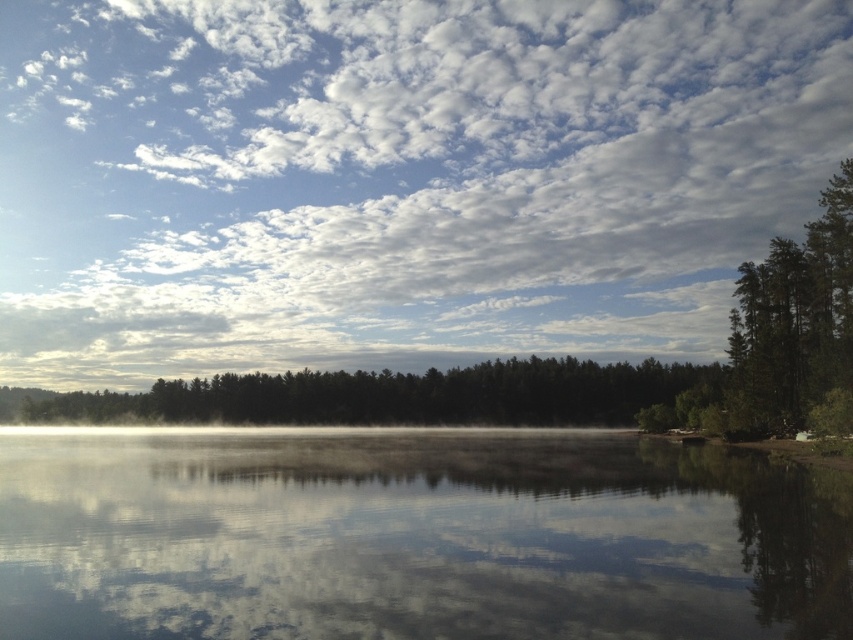
Question: Can you confirm if transparent water at center is positioned to the right of green matte forest at center?

Choices:
 (A) no
 (B) yes

Answer: (B)

Question: Can you confirm if white fluffy cloud at upper center is thinner than green matte forest at center?

Choices:
 (A) yes
 (B) no

Answer: (B)

Question: In this image, where is green matte forest at center located relative to green textured tree at right?

Choices:
 (A) below
 (B) above

Answer: (A)

Question: Which point is farther to the camera?

Choices:
 (A) (631, 314)
 (B) (788, 342)
 (C) (178, 563)

Answer: (A)

Question: Which is farther from the white fluffy cloud at upper center?

Choices:
 (A) transparent water at center
 (B) green textured tree at right
 (C) green matte forest at center

Answer: (B)

Question: Among these points, which one is farthest from the camera?

Choices:
 (A) (537, 484)
 (B) (167, 410)
 (C) (436, 64)

Answer: (C)